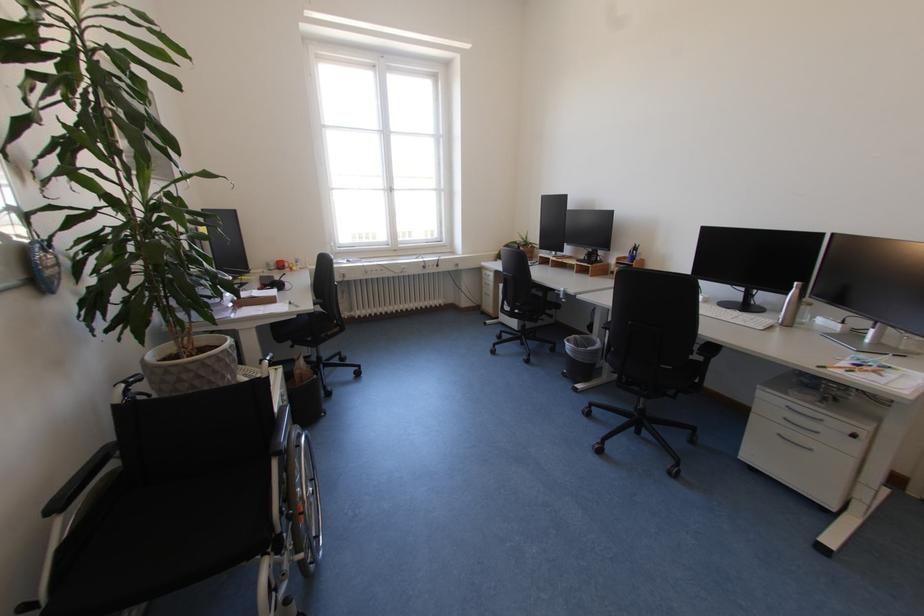
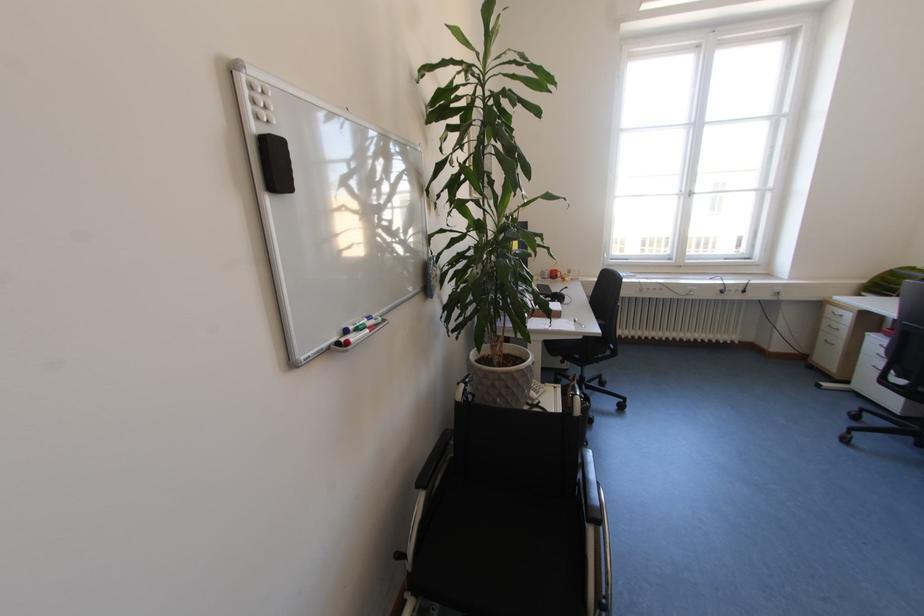
The point at (393, 188) is marked in the first image. Where is the corresponding point in the second image?

(688, 192)